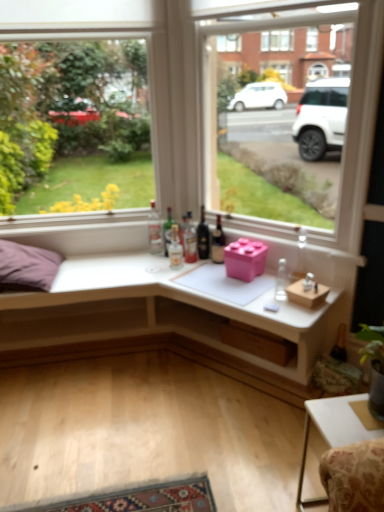
Locate an element on the screen. This screenshot has height=512, width=384. vacant area that lies between translucent glass bottle at center, the 5th bottle when ordered from right to left, and pink matte plastic cube at center, which appears as the 1th window box when viewed from the top is located at coordinates (204, 271).